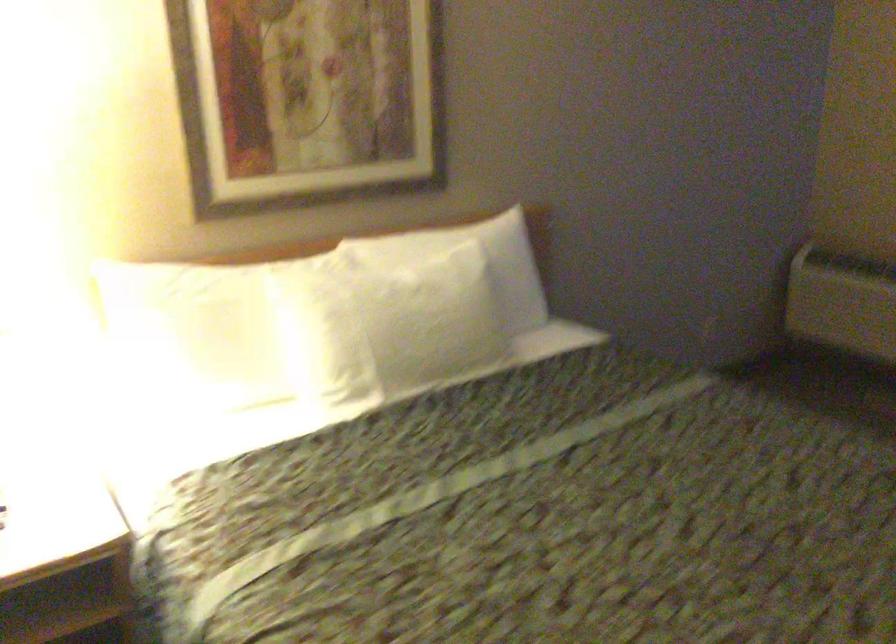
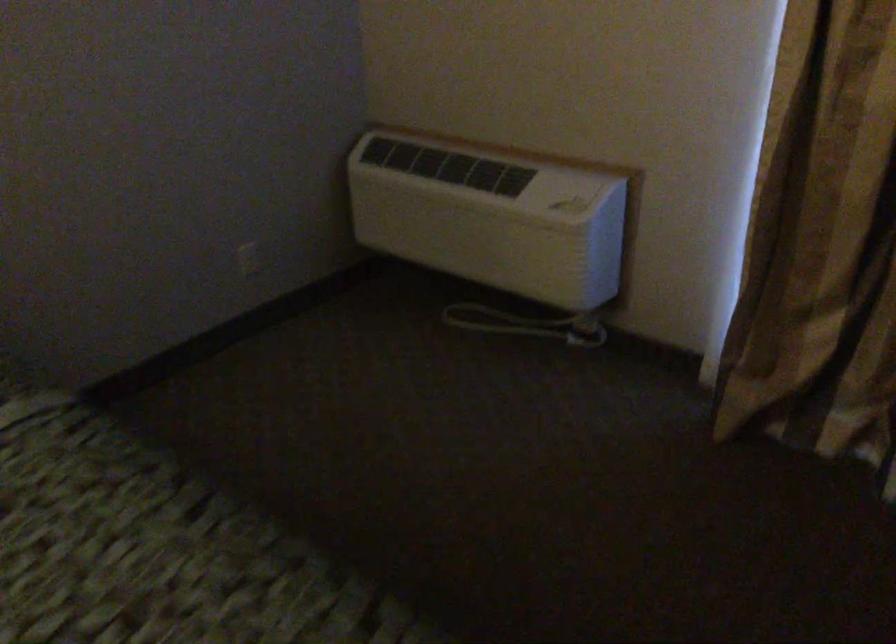
In a continuous first-person perspective shot, in which direction is the camera moving?

The cameraman walked toward right, forward.